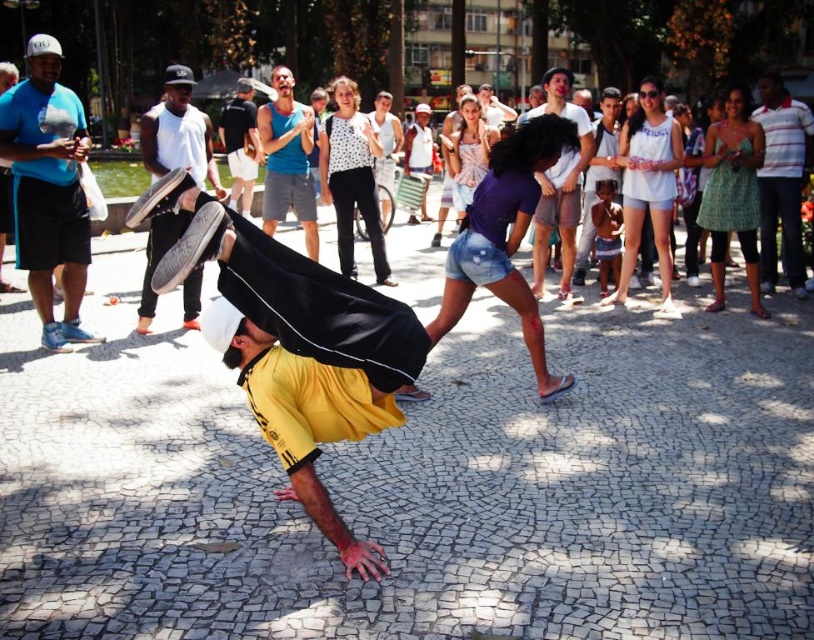
You are a street performer carrying a 10 feet long bamboo pole. You want to place it horizontally between the white canvas drum at upper left and the blue cotton shirt at center. Will the pole fit without bending or breaking?

The distance between the white canvas drum at upper left and the blue cotton shirt at center is 8.76 feet. Since the pole is 10 feet long, it is longer than the available space. Therefore, the pole will not fit without bending or breaking.